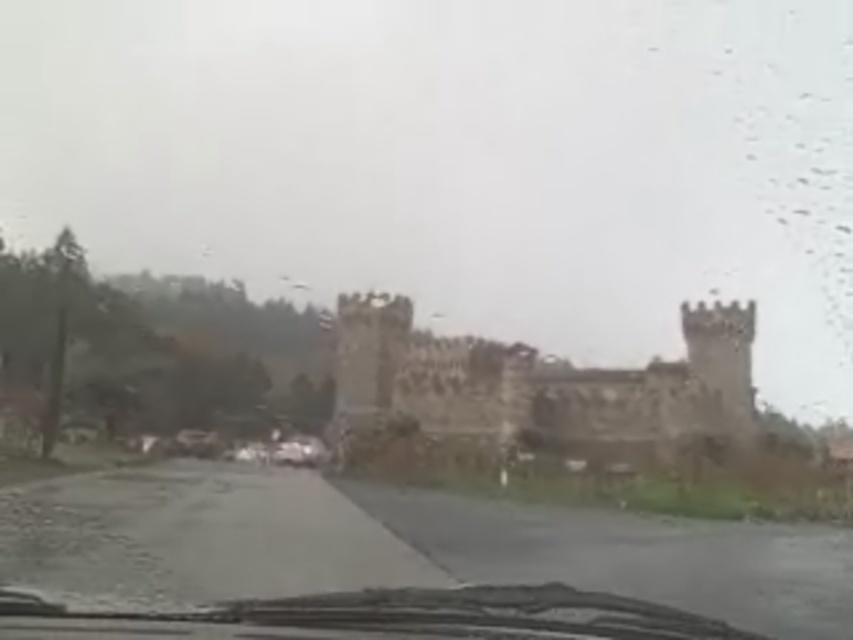
Question: Is brown stone castle at center to the left of metallic silver car at center from the viewer's perspective?

Choices:
 (A) no
 (B) yes

Answer: (A)

Question: Which point is closer to the camera?

Choices:
 (A) (294, 445)
 (B) (518, 628)
 (C) (402, 301)

Answer: (B)

Question: Is transparent glass windshield at center to the right of metallic silver car at center from the viewer's perspective?

Choices:
 (A) no
 (B) yes

Answer: (B)

Question: Can you confirm if transparent glass windshield at center is smaller than metallic silver car at center?

Choices:
 (A) no
 (B) yes

Answer: (A)

Question: Which is farther from the transparent glass windshield at center?

Choices:
 (A) metallic silver car at center
 (B) brown stone castle at center

Answer: (A)

Question: Which object appears closest to the camera in this image?

Choices:
 (A) brown stone castle at center
 (B) transparent glass windshield at center

Answer: (B)